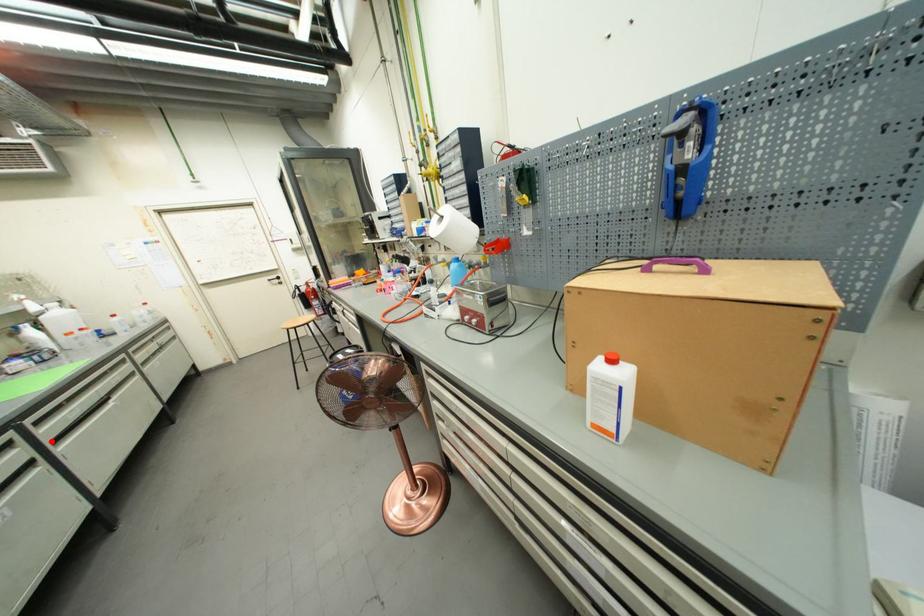
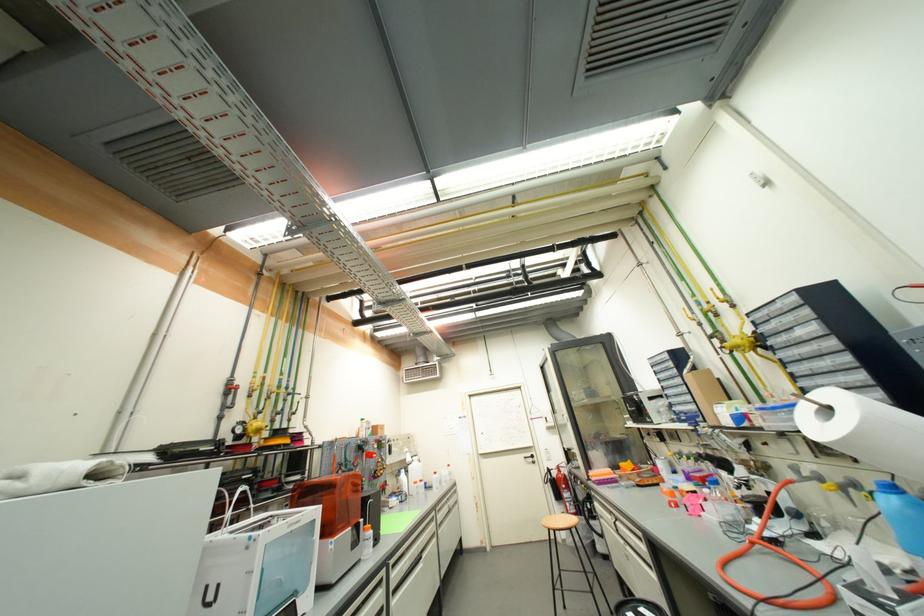
Question: I am providing you with two images of the same scene from different viewpoints. A red point is shown in image1. For the corresponding object point in image2, is it positioned nearer or farther from the camera?

Choices:
 (A) Nearer
 (B) Farther

Answer: (A)